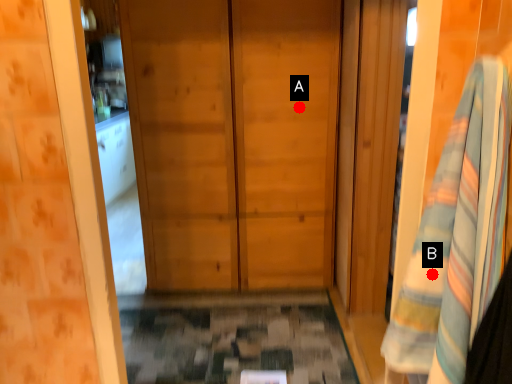
Question: Two points are circled on the image, labeled by A and B beside each circle. Which point appears closest to the camera in this image?

Choices:
 (A) A is closer
 (B) B is closer

Answer: (B)